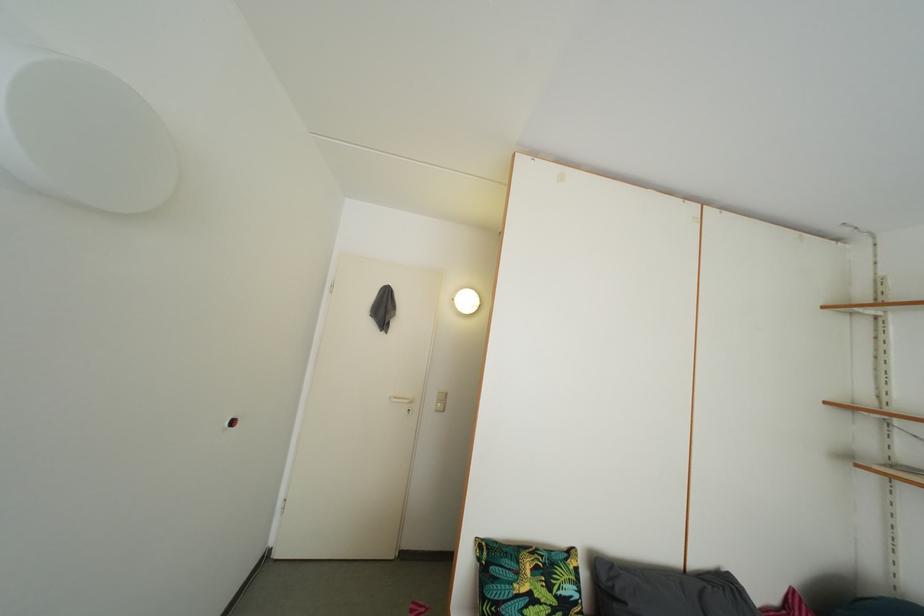
I want to click on white door handle, so click(x=405, y=400).